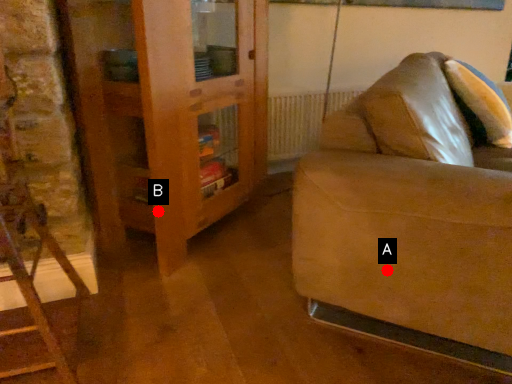
Question: Two points are circled on the image, labeled by A and B beside each circle. Which point is further to the camera?

Choices:
 (A) A is further
 (B) B is further

Answer: (B)